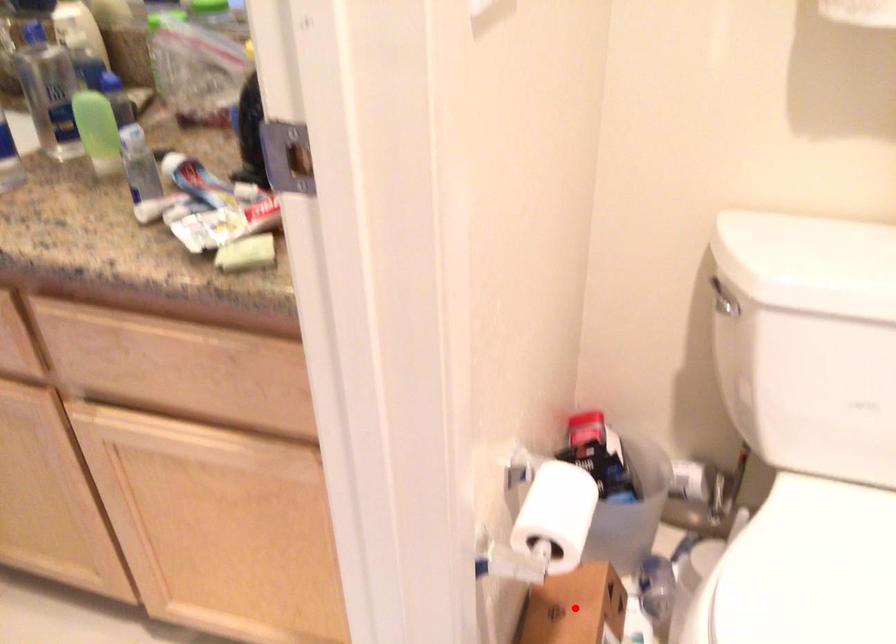
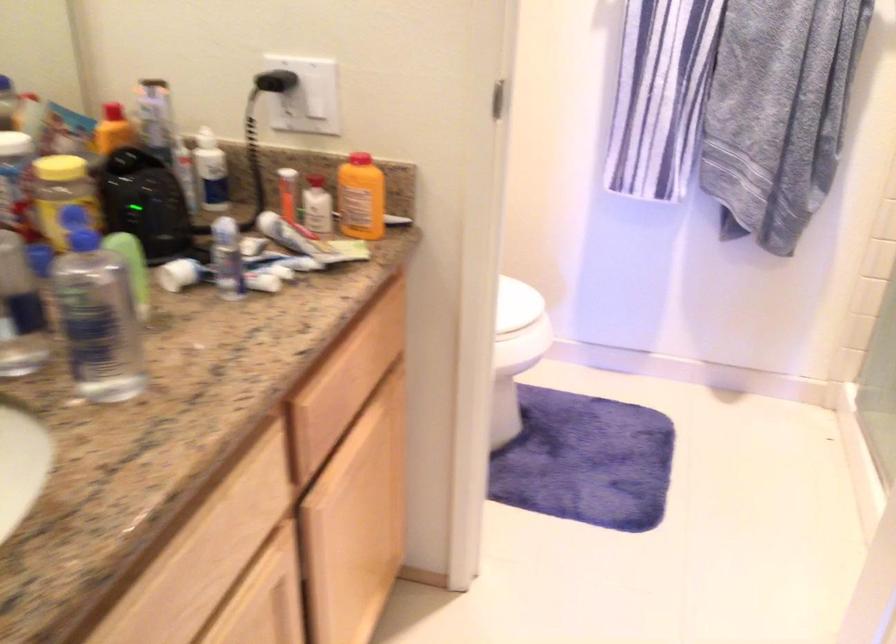
Question: I am providing you with two images of the same scene from different viewpoints. A red point is marked on the first image. Is the red point's position out of view in image 2?

Choices:
 (A) Yes
 (B) No

Answer: (A)